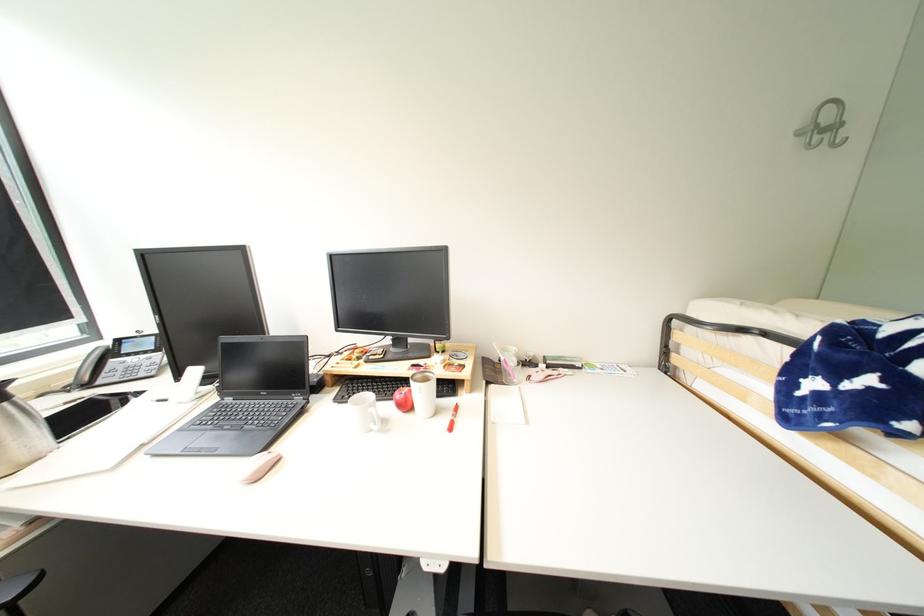
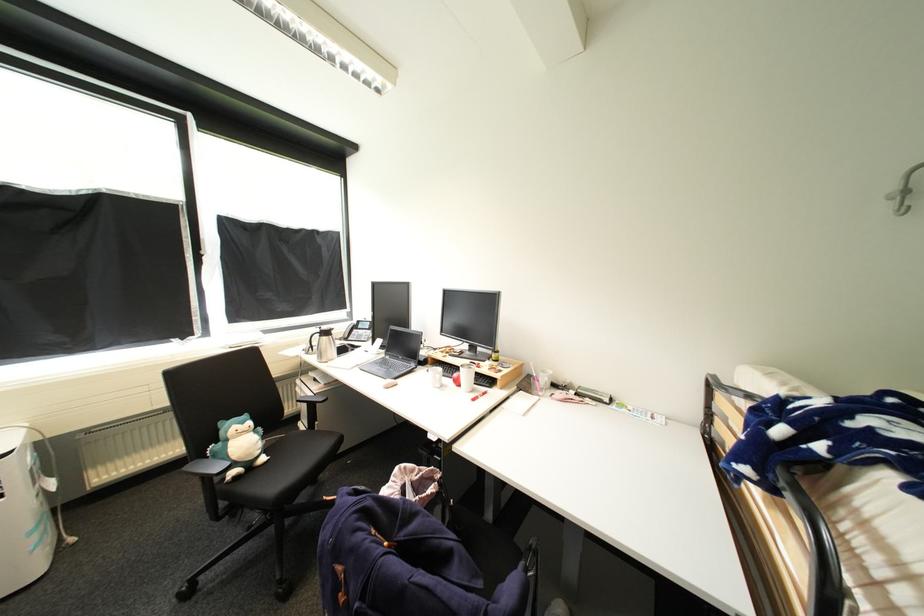
Locate, in the second image, the point that corresponds to point 805,136 in the first image.

(900, 199)